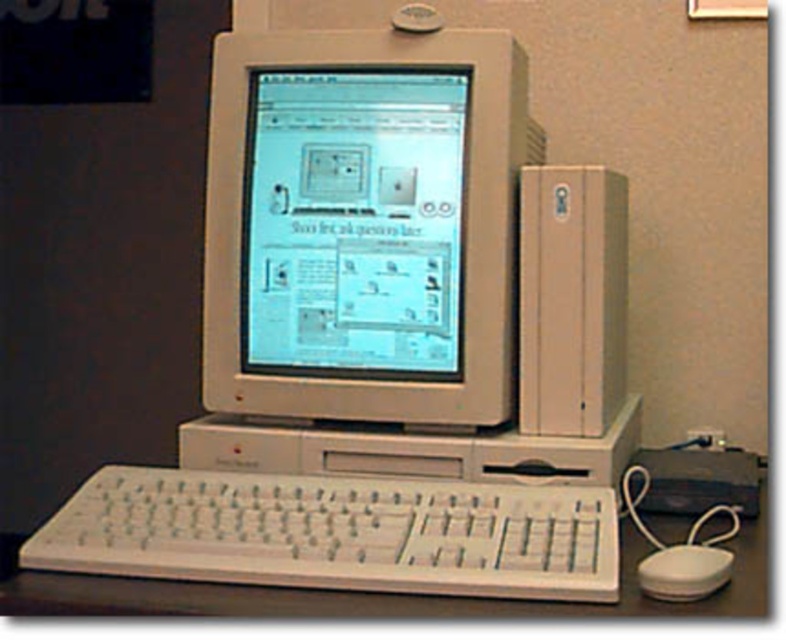
Question: Can you confirm if white plastic keyboard at lower center is positioned above metallic silver tower at right?

Choices:
 (A) yes
 (B) no

Answer: (B)

Question: Among these points, which one is farthest from the camera?

Choices:
 (A) (333, 188)
 (B) (649, 584)
 (C) (410, 499)
 (D) (623, 353)

Answer: (D)

Question: Can you confirm if white plastic monitor at center is positioned above metallic silver tower at right?

Choices:
 (A) yes
 (B) no

Answer: (A)

Question: Considering the real-world distances, which object is farthest from the metallic silver tower at right?

Choices:
 (A) white plastic keyboard at lower center
 (B) white plastic monitor at center

Answer: (A)

Question: Which of these objects is positioned farthest from the metallic silver tower at right?

Choices:
 (A) white plastic monitor at center
 (B) white plastic keyboard at lower center
 (C) white plastic mouse at lower right

Answer: (C)

Question: Where is white plastic monitor at center located in relation to white plastic keyboard at lower center in the image?

Choices:
 (A) below
 (B) above

Answer: (B)